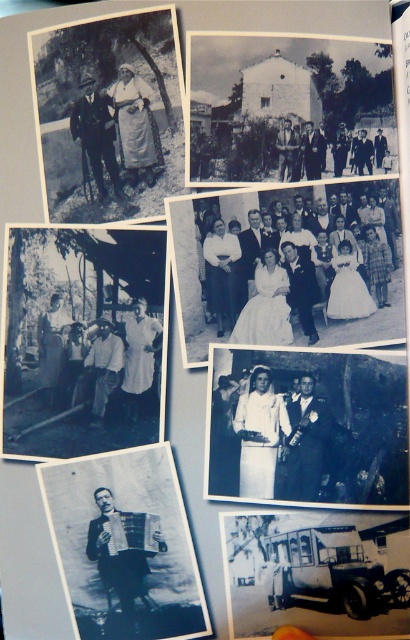
Based on the photo, you are a fashion designer who wants to display both the white satin dress at center and the black fabric accordion at center on a mannequin. Which item should you place on top to ensure visibility?

The white satin dress at center is taller than the black fabric accordion at center, so placing the white satin dress at center on top would ensure visibility.

You are a fashion designer who needs to place a white satin dress at center and a black fabric accordion at center on a runway. The runway is 8 inches wide. Can both items fit side by side without overlapping?

The white satin dress at center and black fabric accordion at center are 8.66 inches apart, which is wider than the runway width of 8 inches. Therefore, they cannot fit side by side without overlapping.

You are a fashion designer examining the white satin dress at center and the black fabric accordion at center displayed on a mannequin. Which item is positioned in front of the other?

The white satin dress at center is closer to the viewer than the black fabric accordion at center, so it is positioned in front of the black fabric accordion at center.